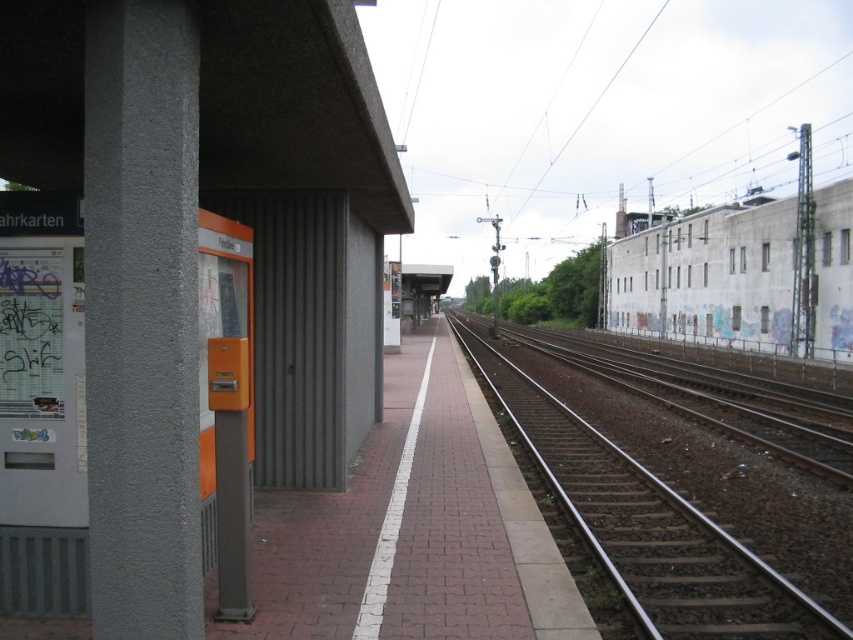
Question: Estimate the real-world distances between objects in this image. Which object is closer to the brown gravel track at right?

Choices:
 (A) gray concrete pillar at left
 (B) orange plastic vending machine at left

Answer: (A)

Question: Among these objects, which one is farthest from the camera?

Choices:
 (A) brown gravel track at right
 (B) gray concrete pillar at left

Answer: (A)

Question: Which object appears farthest from the camera in this image?

Choices:
 (A) orange plastic vending machine at left
 (B) brown gravel track at right

Answer: (A)

Question: Does gray concrete pillar at left have a lesser width compared to brown gravel track at right?

Choices:
 (A) no
 (B) yes

Answer: (B)

Question: Where is orange plastic vending machine at left located in relation to gray concrete pillar at left in the image?

Choices:
 (A) above
 (B) below

Answer: (A)

Question: From the image, what is the correct spatial relationship of gray concrete pillar at left in relation to brown gravel track at right?

Choices:
 (A) above
 (B) below

Answer: (A)